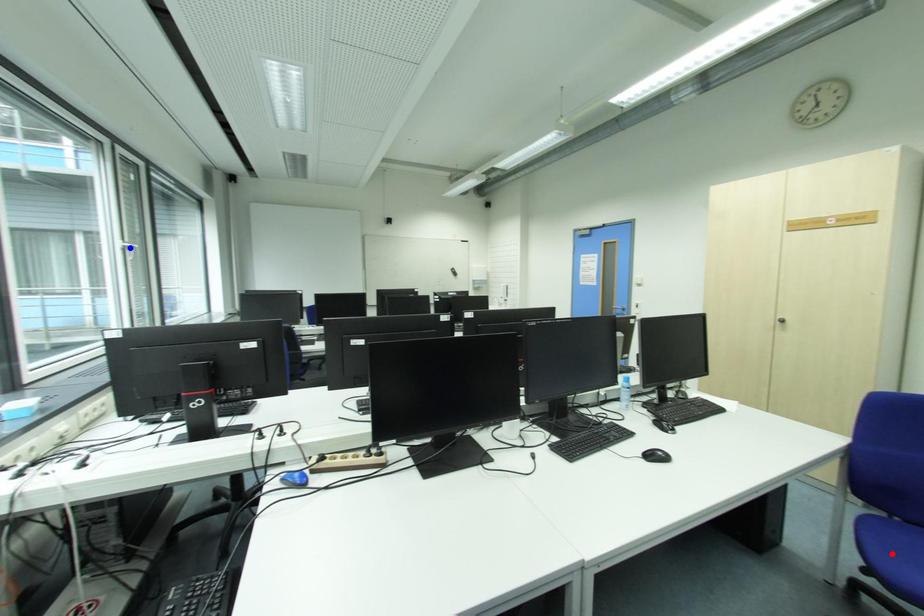
Question: Which of the two points in the image is closer to the camera?

Choices:
 (A) Blue point is closer.
 (B) Red point is closer.

Answer: (B)